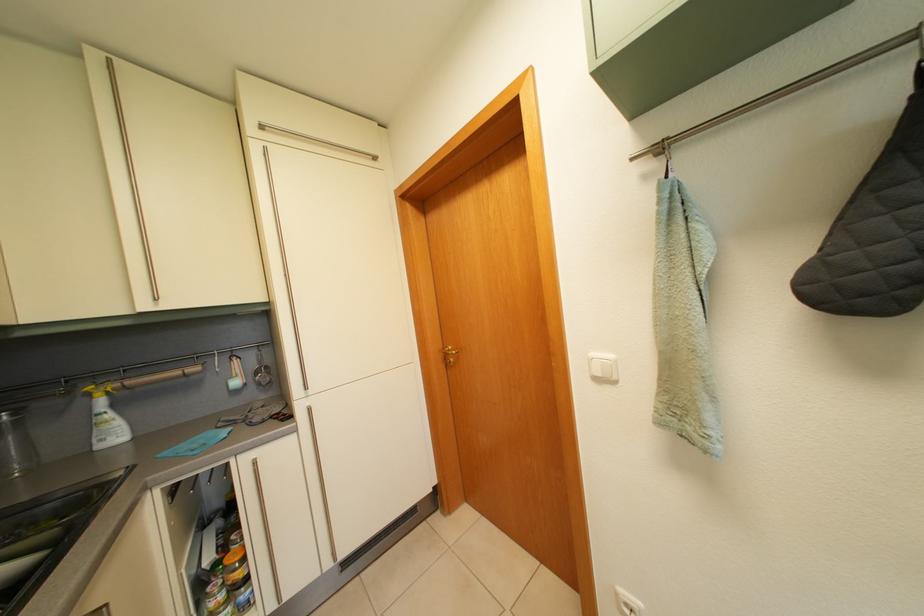
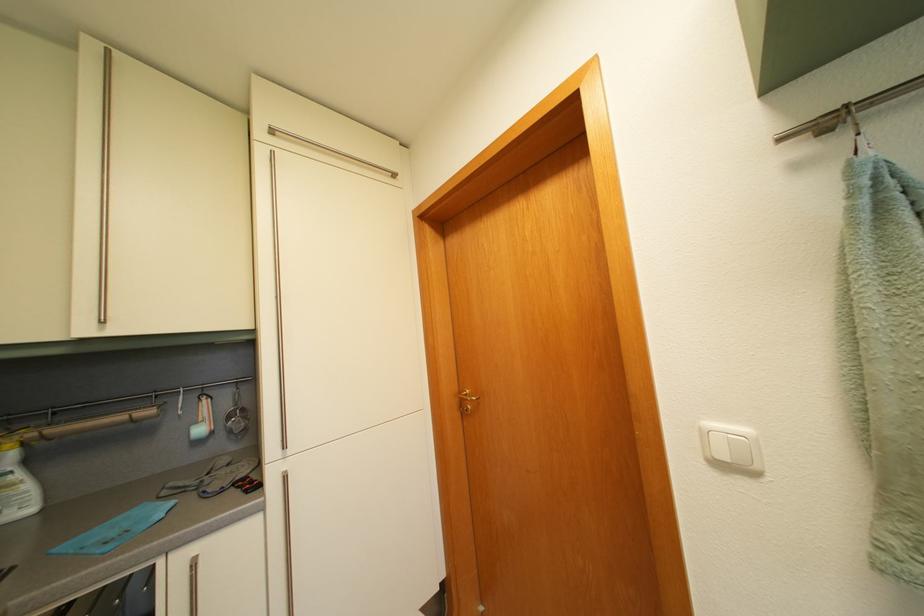
Where in the second image is the point corresponding to the point at 273,129 from the first image?

(284, 132)